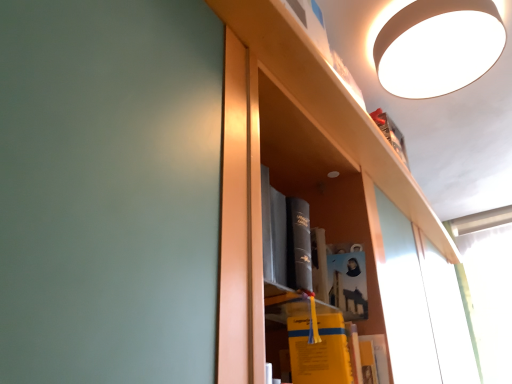
Question: From a real-world perspective, is white matte lampshade at upper right physically located above or below yellow matte book at center, which is the 2th book from top to bottom?

Choices:
 (A) above
 (B) below

Answer: (A)

Question: In terms of width, does white matte lampshade at upper right look wider or thinner when compared to yellow matte book at center, which is the 2th book from top to bottom?

Choices:
 (A) wide
 (B) thin

Answer: (A)

Question: Based on their relative distances, which object is nearer to the matte paper book at center, which is the first book from top to bottom?

Choices:
 (A) yellow matte book at center, the 1th book in the bottom-to-top sequence
 (B) white matte lampshade at upper right

Answer: (A)

Question: Estimate the real-world distances between objects in this image. Which object is farther from the white matte lampshade at upper right?

Choices:
 (A) matte paper book at center, which is the first book from top to bottom
 (B) yellow matte book at center, which is the 2th book from top to bottom

Answer: (B)